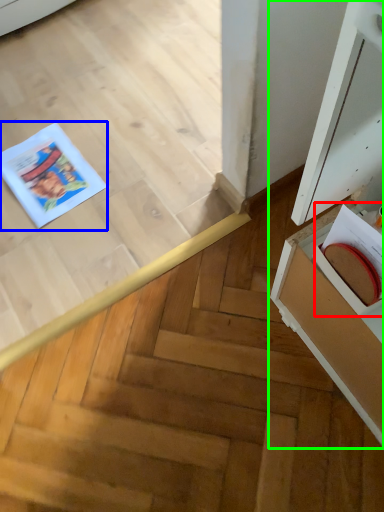
Question: Which object is positioned farthest from book (highlighted by a red box)? Select from comic book (highlighted by a blue box) and cabinetry (highlighted by a green box).

Choices:
 (A) comic book
 (B) cabinetry

Answer: (A)